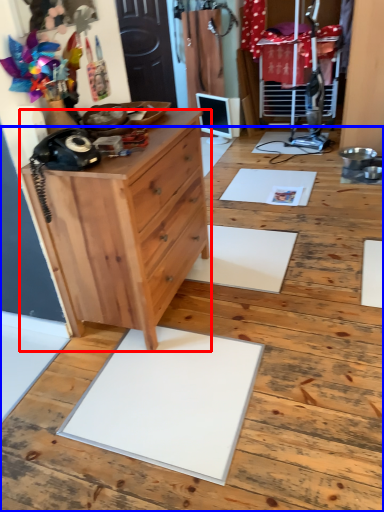
Question: Which of the following is the farthest to the observer, chest of drawers (highlighted by a red box) or hardwood (highlighted by a blue box)?

Choices:
 (A) chest of drawers
 (B) hardwood

Answer: (B)